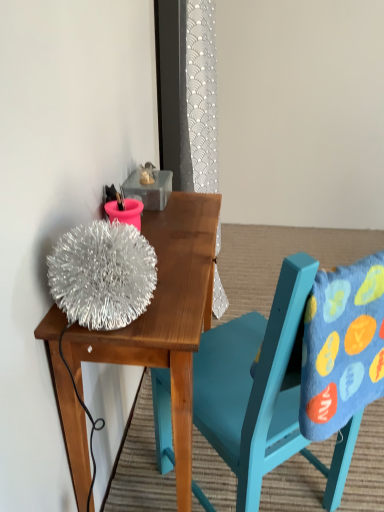
Question: From the image's perspective, is blue felt pillow at right below shiny metallic ball at upper left?

Choices:
 (A) yes
 (B) no

Answer: (B)

Question: Is blue felt pillow at right not close to shiny metallic ball at upper left?

Choices:
 (A) no
 (B) yes

Answer: (A)

Question: Does blue felt pillow at right have a lesser width compared to shiny metallic ball at upper left?

Choices:
 (A) yes
 (B) no

Answer: (A)

Question: Are blue felt pillow at right and shiny metallic ball at upper left making contact?

Choices:
 (A) yes
 (B) no

Answer: (B)

Question: From the image's perspective, does blue felt pillow at right appear higher than shiny metallic ball at upper left?

Choices:
 (A) no
 (B) yes

Answer: (B)

Question: Is shiny metallic ball at upper left surrounded by blue felt pillow at right?

Choices:
 (A) yes
 (B) no

Answer: (B)

Question: From a real-world perspective, is teal painted wood chair at upper center under shiny metallic ball at upper left?

Choices:
 (A) yes
 (B) no

Answer: (B)

Question: Are teal painted wood chair at upper center and shiny metallic ball at upper left located far from each other?

Choices:
 (A) yes
 (B) no

Answer: (B)

Question: From the image's perspective, is teal painted wood chair at upper center on top of shiny metallic ball at upper left?

Choices:
 (A) yes
 (B) no

Answer: (A)

Question: Is teal painted wood chair at upper center smaller than shiny metallic ball at upper left?

Choices:
 (A) no
 (B) yes

Answer: (A)

Question: Is teal painted wood chair at upper center next to shiny metallic ball at upper left?

Choices:
 (A) yes
 (B) no

Answer: (B)

Question: Considering the relative positions of teal painted wood chair at upper center and shiny metallic ball at upper left in the image provided, is teal painted wood chair at upper center to the right of shiny metallic ball at upper left from the viewer's perspective?

Choices:
 (A) yes
 (B) no

Answer: (A)

Question: Is teal painted wood chair at upper center a part of shiny metallic ball at upper left?

Choices:
 (A) no
 (B) yes

Answer: (A)